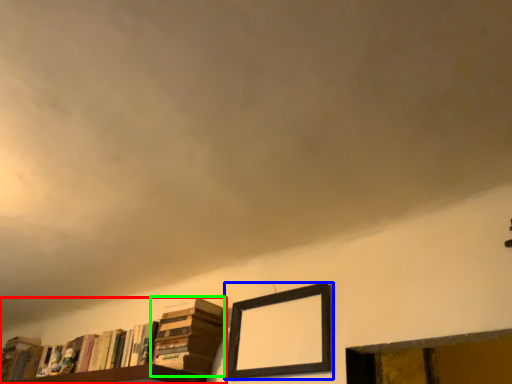
Question: Which object is the farthest from book (highlighted by a red box)? Choose among these: picture frame (highlighted by a blue box) or book (highlighted by a green box).

Choices:
 (A) picture frame
 (B) book

Answer: (A)